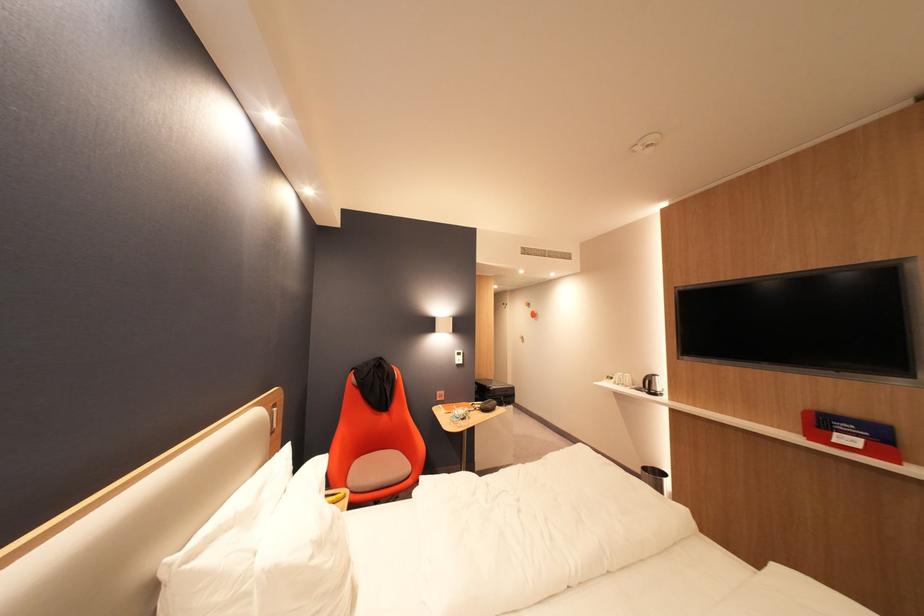
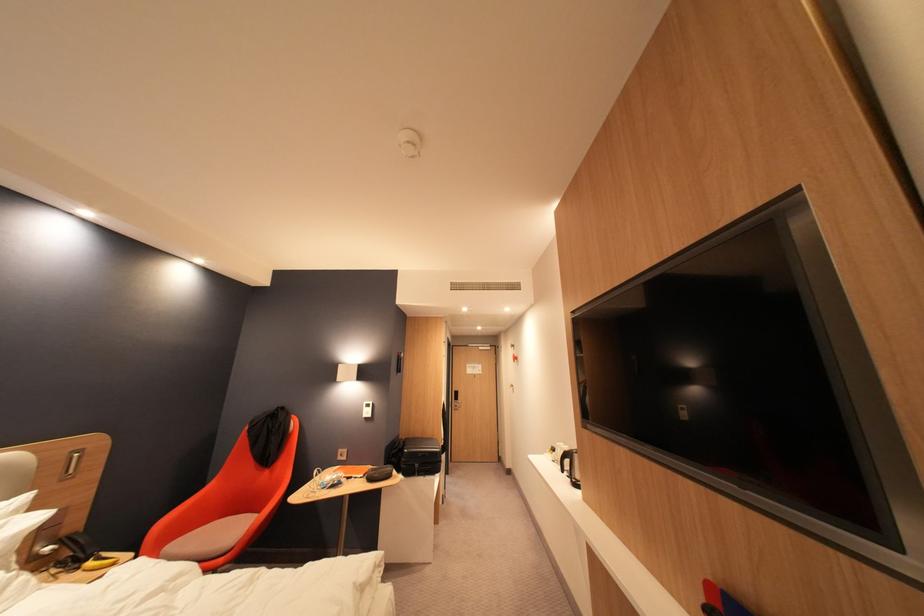
The point at (512, 400) is marked in the first image. Where is the corresponding point in the second image?

(427, 467)